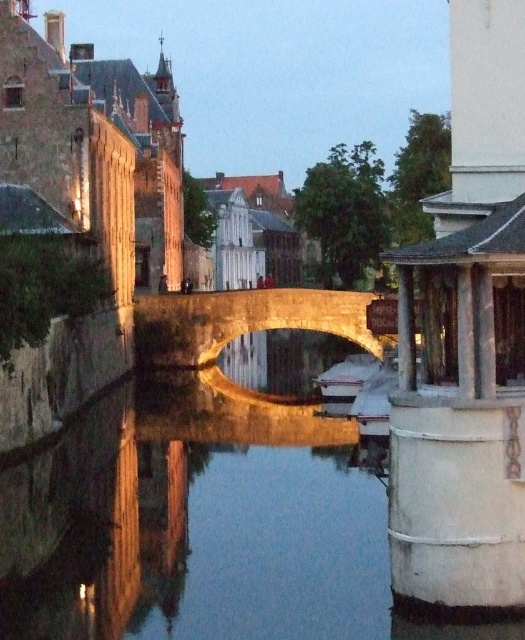
The image size is (525, 640). Describe the element at coordinates (200, 528) in the screenshot. I see `smooth concrete river at center` at that location.

Which is in front, point (151, 456) or point (359, 387)?

Point (151, 456)

The height and width of the screenshot is (640, 525). Describe the element at coordinates (200, 528) in the screenshot. I see `smooth concrete river at center` at that location.

The width and height of the screenshot is (525, 640). I want to click on smooth concrete river at center, so click(x=200, y=528).

Between stone arch bridge at center and white plastic boat at center, which one appears on the left side from the viewer's perspective?

From the viewer's perspective, stone arch bridge at center appears more on the left side.

Who is positioned more to the right, stone arch bridge at center or white plastic boat at center?

From the viewer's perspective, white plastic boat at center appears more on the right side.

Is point (330, 317) more distant than point (330, 387)?

That is True.

Where is `stone arch bridge at center`? This screenshot has height=640, width=525. stone arch bridge at center is located at coordinates (255, 321).

Who is more forward, [472,628] or [344,301]?

Point [472,628] is more forward.

Is point (378, 604) closer to camera compared to point (257, 310)?

That is True.

You are a GUI agent. You are given a task and a screenshot of the screen. Output one action in this format:
    pyautogui.click(x=<x>, y=<y>)
    Task: Click on the smooth concrete river at center
    
    Given the screenshot: What is the action you would take?
    pyautogui.click(x=200, y=528)